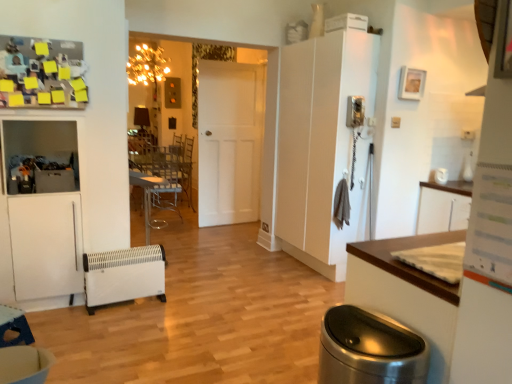
Question: From a real-world perspective, is wooden table at lower left, which is counted as the 2th table, starting from the right, on white matte cabinet at right?

Choices:
 (A) yes
 (B) no

Answer: (B)

Question: From the image's perspective, is wooden table at lower left, marked as the first table in a left-to-right arrangement, below white matte cabinet at right?

Choices:
 (A) no
 (B) yes

Answer: (B)

Question: Can you confirm if wooden table at lower left, marked as the second table in a top-to-bottom arrangement, is taller than white matte cabinet at right?

Choices:
 (A) yes
 (B) no

Answer: (B)

Question: From a real-world perspective, is wooden table at lower left, placed as the 1th table when sorted from bottom to top, beneath white matte cabinet at right?

Choices:
 (A) yes
 (B) no

Answer: (A)

Question: Considering the relative sizes of wooden table at lower left, marked as the first table in a left-to-right arrangement, and white matte cabinet at right in the image provided, is wooden table at lower left, marked as the first table in a left-to-right arrangement, thinner than white matte cabinet at right?

Choices:
 (A) no
 (B) yes

Answer: (B)

Question: Does wooden table at lower left, placed as the 1th table when sorted from bottom to top, turn towards white matte cabinet at right?

Choices:
 (A) yes
 (B) no

Answer: (B)

Question: From the image's perspective, is clear plastic chair at center under white matte door at center?

Choices:
 (A) no
 (B) yes

Answer: (B)

Question: Are clear plastic chair at center and white matte door at center located far from each other?

Choices:
 (A) no
 (B) yes

Answer: (B)

Question: Can you confirm if clear plastic chair at center is smaller than white matte door at center?

Choices:
 (A) no
 (B) yes

Answer: (B)

Question: Would you say clear plastic chair at center is outside white matte door at center?

Choices:
 (A) no
 (B) yes

Answer: (B)

Question: From the image's perspective, is clear plastic chair at center over white matte door at center?

Choices:
 (A) no
 (B) yes

Answer: (A)

Question: Considering the relative sizes of clear plastic chair at center and white matte door at center in the image provided, is clear plastic chair at center wider than white matte door at center?

Choices:
 (A) yes
 (B) no

Answer: (A)

Question: Is polished stainless steel trash can at lower right further to camera compared to white matte cabinet at right?

Choices:
 (A) no
 (B) yes

Answer: (A)